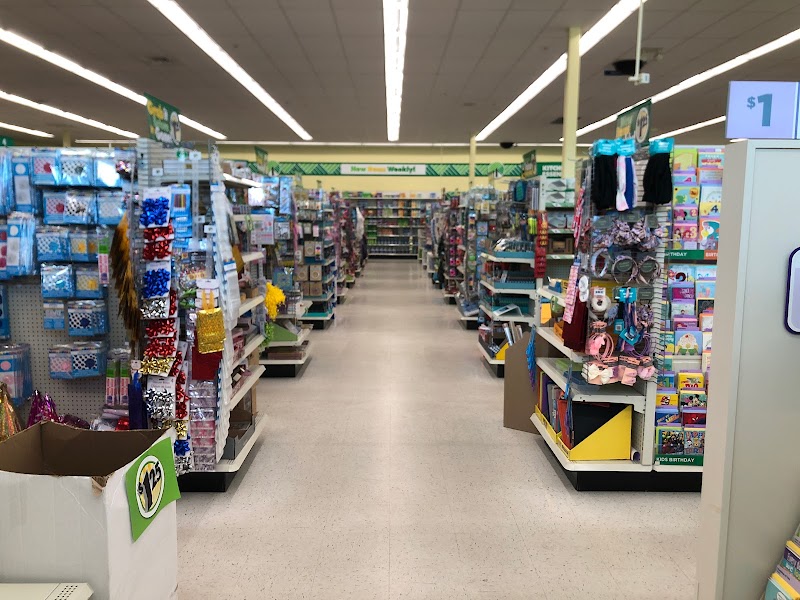
At what (x,y) coordinates should I click in order to perform the action: click on fluorescent lighting. Please return your answer as a coordinate pair (x, y). The width and height of the screenshot is (800, 600). Looking at the image, I should click on (389, 70), (114, 86), (214, 55), (62, 115), (510, 109), (688, 81), (692, 128).